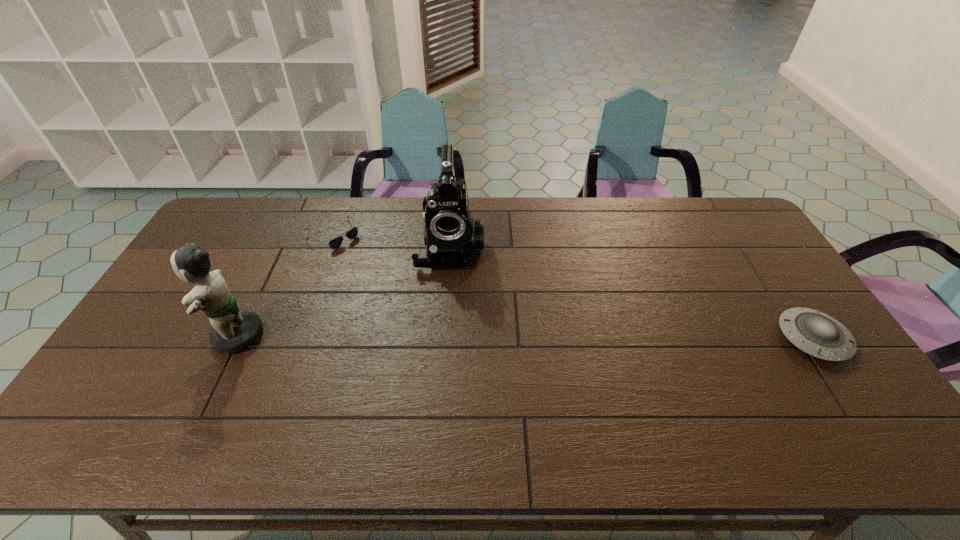
At what (x,y) coordinates should I click in order to perform the action: click on figurine. Please return your answer as a coordinate pair (x, y). This screenshot has width=960, height=540. Looking at the image, I should click on (233, 330).

You are a GUI agent. You are given a task and a screenshot of the screen. Output one action in this format:
    pyautogui.click(x=<x>, y=<y>)
    Task: Click on the saucer
    The height and width of the screenshot is (540, 960).
    Given the screenshot: What is the action you would take?
    pyautogui.click(x=815, y=333)

At what (x,y) coordinates should I click in order to perform the action: click on camcorder. Please return your answer as a coordinate pair (x, y). Looking at the image, I should click on (450, 235).

You are a GUI agent. You are given a task and a screenshot of the screen. Output one action in this format:
    pyautogui.click(x=<x>, y=<y>)
    Task: Click on the third object from right to left
    
    Given the screenshot: What is the action you would take?
    pyautogui.click(x=335, y=243)

Locate an element on the screen. This screenshot has width=960, height=540. blank area located 0.050m on the front-facing side of the figurine is located at coordinates (188, 335).

Locate an element on the screen. The width and height of the screenshot is (960, 540). vacant space located on the front-facing side of the figurine is located at coordinates (163, 335).

Locate an element on the screen. This screenshot has height=540, width=960. free space located 0.220m on the left of the saucer is located at coordinates (700, 338).

I want to click on vacant area located 0.330m on the lens mount of the second object from right to left, so click(448, 361).

At what (x,y) coordinates should I click in order to perform the action: click on vacant position located on the lens mount of the second object from right to left. Please return your answer as a coordinate pair (x, y). Looking at the image, I should click on (448, 348).

Identify the location of vacant area situated on the lens mount of the second object from right to left. This screenshot has width=960, height=540. (449, 334).